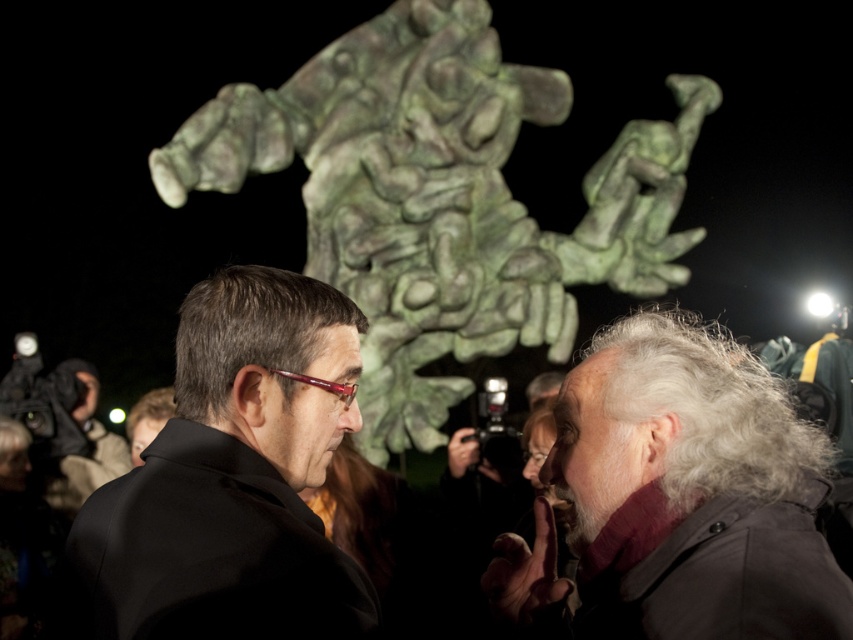
Is green patina stone sculpture at upper center to the left of gray woolen scarf at lower right from the viewer's perspective?

Correct, you'll find green patina stone sculpture at upper center to the left of gray woolen scarf at lower right.

Is green patina stone sculpture at upper center taller than gray woolen scarf at lower right?

Indeed, green patina stone sculpture at upper center has a greater height compared to gray woolen scarf at lower right.

Where is `green patina stone sculpture at upper center`? green patina stone sculpture at upper center is located at coordinates (440, 198).

Between green patina stone sculpture at upper center and black matte suit at center, which one is positioned lower?

Positioned lower is black matte suit at center.

Between green patina stone sculpture at upper center and black matte suit at center, which one appears on the left side from the viewer's perspective?

black matte suit at center is more to the left.

The image size is (853, 640). What do you see at coordinates (440, 198) in the screenshot?
I see `green patina stone sculpture at upper center` at bounding box center [440, 198].

The width and height of the screenshot is (853, 640). I want to click on green patina stone sculpture at upper center, so click(440, 198).

Which is below, gray woolen scarf at lower right or black matte suit at center?

gray woolen scarf at lower right is lower down.

Can you confirm if gray woolen scarf at lower right is positioned above black matte suit at center?

No.

Is point (724, 572) more distant than point (234, 586)?

Yes.

The width and height of the screenshot is (853, 640). Identify the location of gray woolen scarf at lower right. (677, 499).